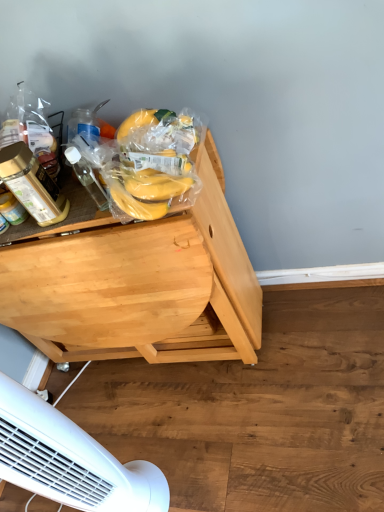
Question: Is translucent plastic bottle at left, which appears as the 1th bottle when viewed from the left, not inside yellow matte bananas at center, the 2th food in the top-to-bottom sequence?

Choices:
 (A) no
 (B) yes

Answer: (B)

Question: From a real-world perspective, is translucent plastic bottle at left, the second bottle in the right-to-left sequence, located higher than yellow matte bananas at center, which is counted as the 1th food, starting from the bottom?

Choices:
 (A) yes
 (B) no

Answer: (A)

Question: Does translucent plastic bottle at left, which appears as the 1th bottle when viewed from the left, have a larger size compared to yellow matte bananas at center, which is counted as the 1th food, starting from the bottom?

Choices:
 (A) no
 (B) yes

Answer: (A)

Question: From the image's perspective, would you say translucent plastic bottle at left, the second bottle in the right-to-left sequence, is positioned over yellow matte bananas at center, the 2th food in the top-to-bottom sequence?

Choices:
 (A) no
 (B) yes

Answer: (B)

Question: Can you confirm if translucent plastic bottle at left, which appears as the 1th bottle when viewed from the left, is shorter than yellow matte bananas at center, the 2th food in the top-to-bottom sequence?

Choices:
 (A) no
 (B) yes

Answer: (A)

Question: Visually, is yellow matte bananas at center, which is counted as the 1th food, starting from the bottom, positioned to the left or to the right of transparent plastic bottle at left, which is counted as the 1th bottle, starting from the right?

Choices:
 (A) right
 (B) left

Answer: (A)

Question: Does point (125, 210) appear closer or farther from the camera than point (74, 160)?

Choices:
 (A) closer
 (B) farther

Answer: (A)

Question: In the image, is yellow matte bananas at center, which is counted as the 1th food, starting from the bottom, positioned in front of or behind transparent plastic bottle at left, which is counted as the second bottle, starting from the left?

Choices:
 (A) behind
 (B) front

Answer: (B)

Question: Looking at the image, does yellow matte bananas at center, which is counted as the 1th food, starting from the bottom, seem bigger or smaller compared to transparent plastic bottle at left, which is counted as the second bottle, starting from the left?

Choices:
 (A) big
 (B) small

Answer: (A)

Question: Considering their positions, is yellow matte bananas at center, which is counted as the 1th food, starting from the bottom, located in front of or behind translucent plastic bottle at left, the second bottle in the right-to-left sequence?

Choices:
 (A) behind
 (B) front

Answer: (B)

Question: Considering the positions of yellow matte bananas at center, which is counted as the 1th food, starting from the bottom, and translucent plastic bottle at left, which appears as the 1th bottle when viewed from the left, in the image, is yellow matte bananas at center, which is counted as the 1th food, starting from the bottom, taller or shorter than translucent plastic bottle at left, which appears as the 1th bottle when viewed from the left,?

Choices:
 (A) tall
 (B) short

Answer: (B)

Question: In terms of width, does yellow matte bananas at center, the 2th food in the top-to-bottom sequence, look wider or thinner when compared to translucent plastic bottle at left, the second bottle in the right-to-left sequence?

Choices:
 (A) thin
 (B) wide

Answer: (B)

Question: From the image's perspective, relative to translucent plastic bottle at left, which appears as the 1th bottle when viewed from the left, is yellow matte bananas at center, the 2th food in the top-to-bottom sequence, above or below?

Choices:
 (A) below
 (B) above

Answer: (A)

Question: Is point (18, 112) positioned closer to the camera than point (46, 202)?

Choices:
 (A) farther
 (B) closer

Answer: (A)

Question: In terms of height, does yellow matte bananas at upper left, which is the 1th food from top to bottom, look taller or shorter compared to translucent plastic bottle at left, the second bottle in the right-to-left sequence?

Choices:
 (A) tall
 (B) short

Answer: (B)